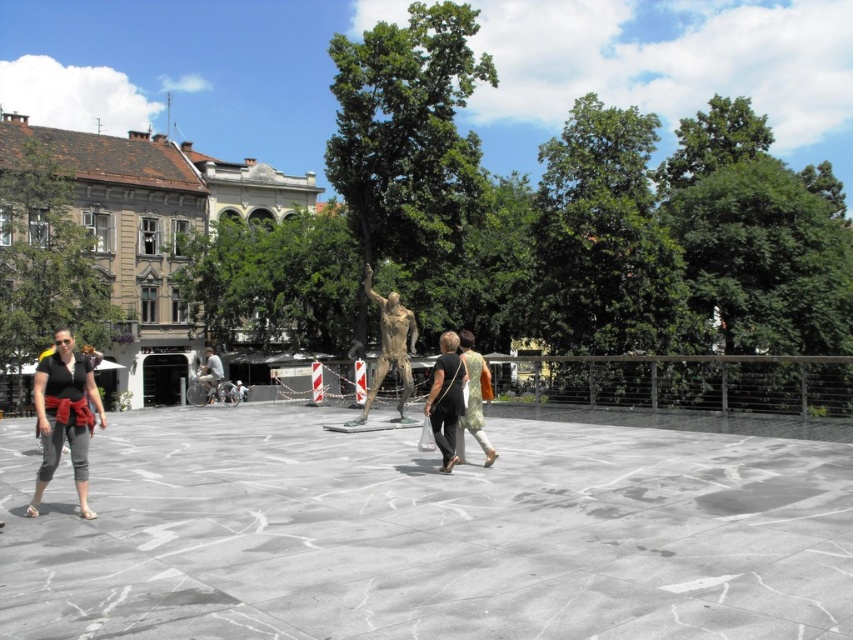
You are standing at the location of the matte black shirt at lower left and want to take a photo of the sculpture in the center. The camera you need is 22.51 meters away from you. Is the camera close enough to capture the sculpture clearly from your current position?

The camera is 22.51 meters away from the matte black shirt at lower left. Since the sculpture is in the center of the plaza and the shirt is at the lower left, the distance between you and the camera may allow capturing the sculpture clearly, but it depends on the camera lens and zoom capabilities. However, based on the given information, the camera is 22.51 meters away from you.